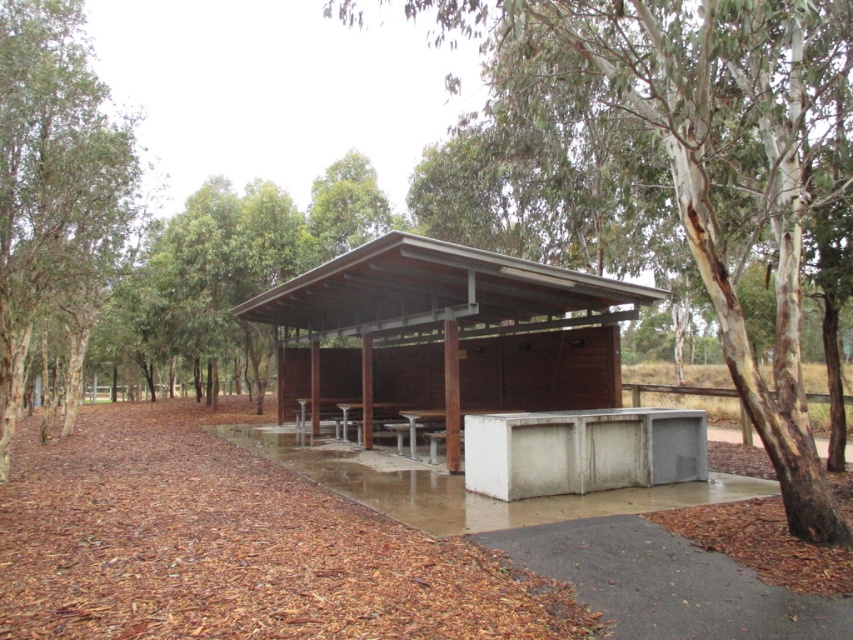
Question: Which object is farther from the camera taking this photo?

Choices:
 (A) brown wood/hardwood hut at center
 (B) white bark tree at center
 (C) green leafy tree at left

Answer: (C)

Question: Based on their relative distances, which object is nearer to the white bark tree at center?

Choices:
 (A) green leafy tree at left
 (B) brown wood/hardwood hut at center
 (C) metallic silver picnic table at center

Answer: (B)

Question: Can you confirm if white bark tree at center is positioned above metallic silver picnic table at center?

Choices:
 (A) no
 (B) yes

Answer: (B)

Question: Can you confirm if green leafy tree at left is positioned above metallic silver picnic table at center?

Choices:
 (A) yes
 (B) no

Answer: (A)

Question: Where is brown wood/hardwood hut at center located in relation to green leafy tree at left in the image?

Choices:
 (A) left
 (B) right

Answer: (B)

Question: Estimate the real-world distances between objects in this image. Which object is closer to the white bark tree at center?

Choices:
 (A) metallic silver picnic table at center
 (B) brown wood/hardwood hut at center
 (C) green leafy tree at left

Answer: (B)